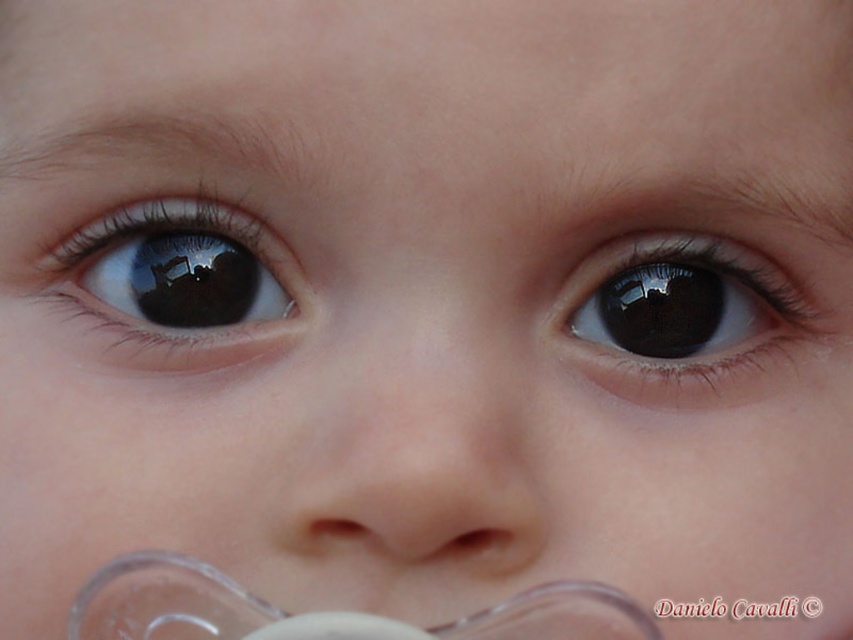
You are a photographer adjusting the focus on your camera. You notice two objects in the frame that need to be in focus simultaneously. The objects are the black glossy eye at upper right and the transparent plastic pacifier at lower center. Based on their sizes in the image, which object should you prioritize focusing on first?

The black glossy eye at upper right should be prioritized for focusing first because it is bigger than the transparent plastic pacifier at lower center, making it more prominent in the frame.

You are a photographer adjusting the focus on your camera. You notice two points in the image at coordinates point (x=141, y=208) and point (x=554, y=632). Which point should you focus on to ensure the baby is in sharp focus?

You should focus on point (x=141, y=208) because it is closer to the viewer than point (x=554, y=632), ensuring the baby is in sharp focus.

You are a photographer adjusting the focus on your camera. You notice the black glossy eye at upper right and the transparent plastic pacifier at lower center in the frame. Which object should you focus on first if you want to ensure the wider object is in sharp focus?

You should focus on the transparent plastic pacifier at lower center first because it has a greater width than the black glossy eye at upper right, making it the wider object in the scene.